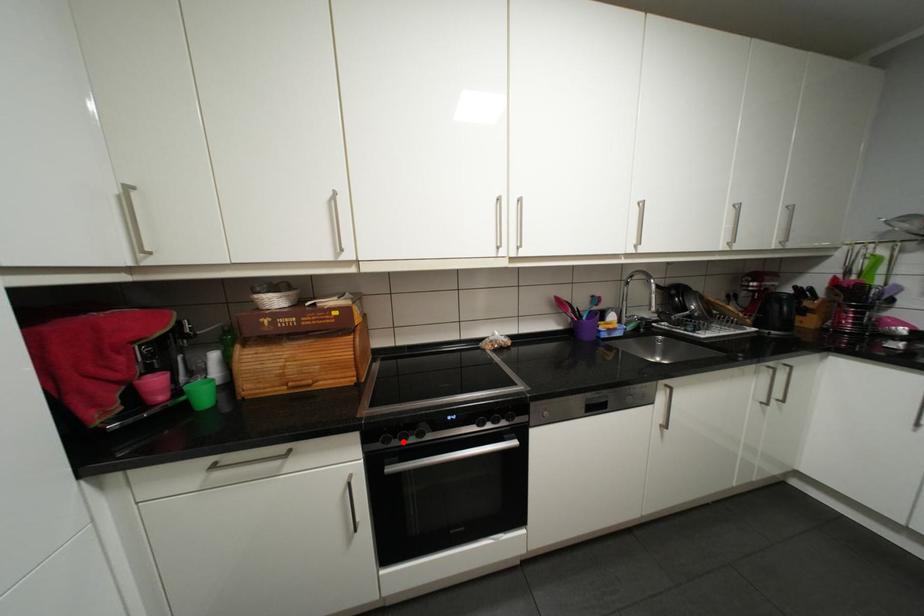
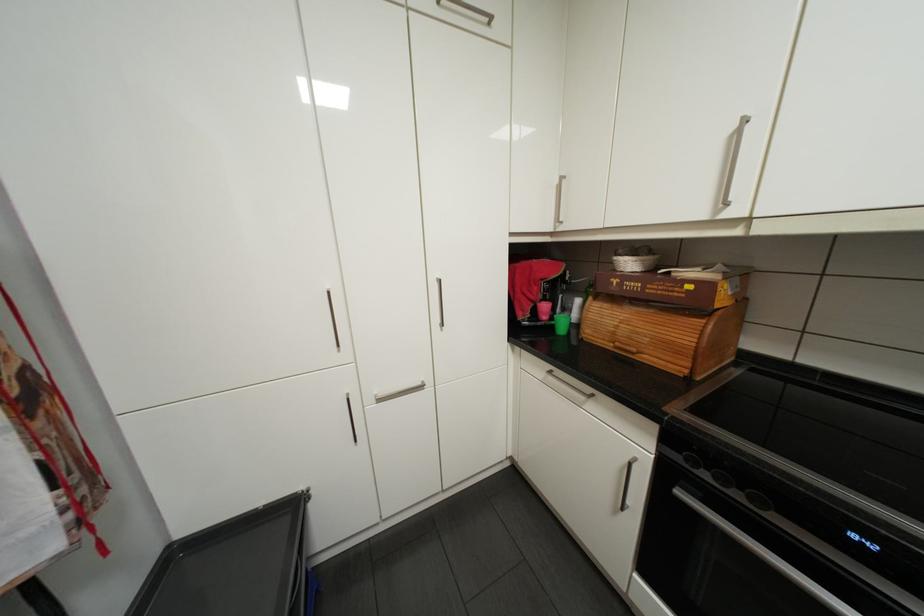
Find the pixel in the second image that matches the highlighted location in the first image.

(712, 474)